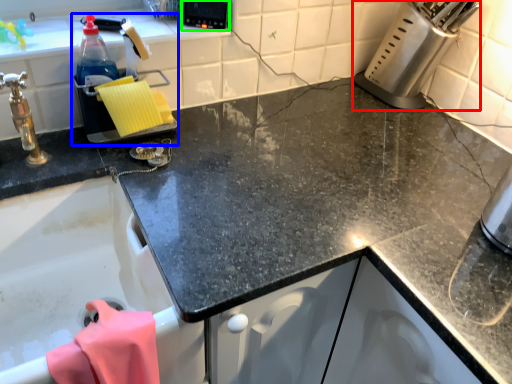
Question: Considering the real-world distances, which object is farthest from appliance (highlighted by a red box)? appliance (highlighted by a blue box) or appliance (highlighted by a green box)?

Choices:
 (A) appliance
 (B) appliance

Answer: (A)